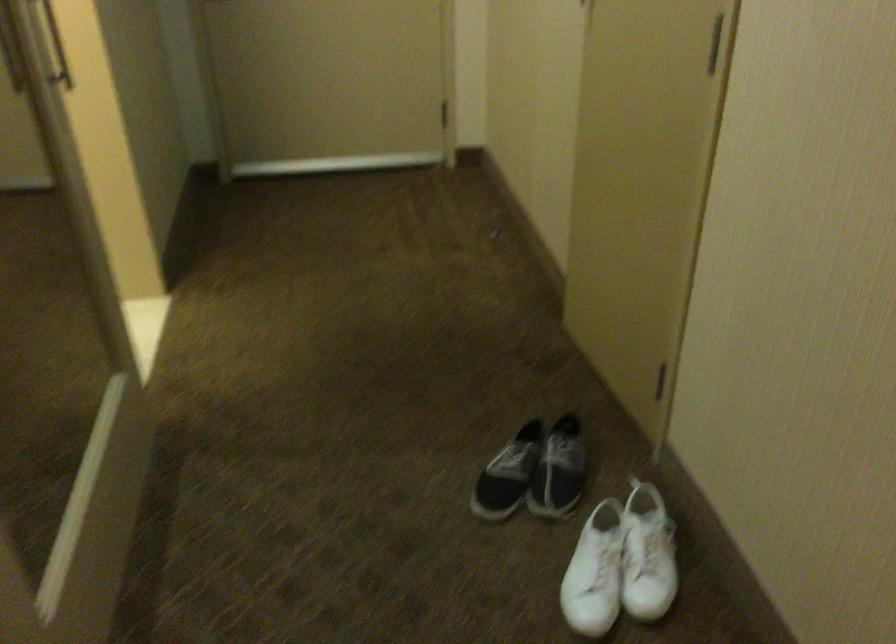
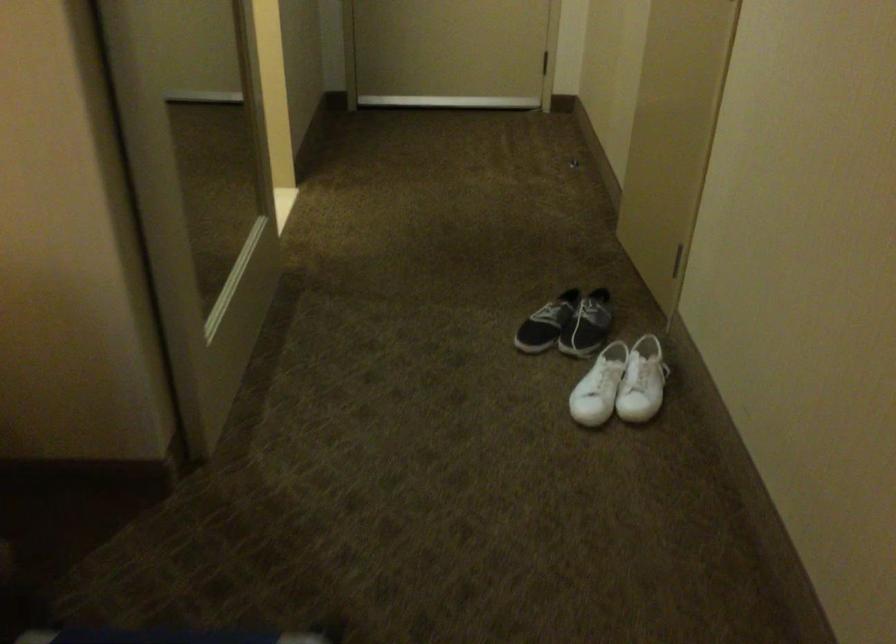
In the second image, find the point that corresponds to [645,558] in the first image.

(642, 382)